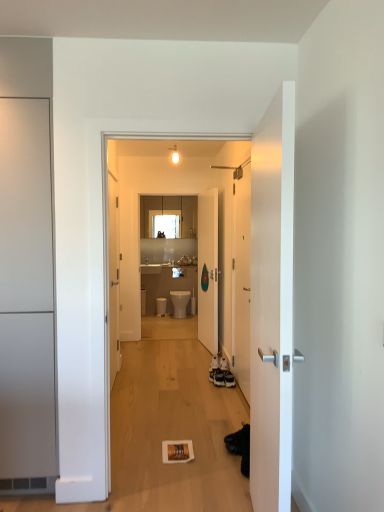
Question: Considering the relative sizes of white matte door at left, which appears as the 3th door when viewed from the back, and matte wood cabinets at upper center in the image provided, is white matte door at left, which appears as the 3th door when viewed from the back, thinner than matte wood cabinets at upper center?

Choices:
 (A) yes
 (B) no

Answer: (B)

Question: From a real-world perspective, is white matte door at left, which is the 4th door from right to left, located beneath matte wood cabinets at upper center?

Choices:
 (A) no
 (B) yes

Answer: (B)

Question: Is white matte door at left, which appears as the 3th door when viewed from the back, not within matte wood cabinets at upper center?

Choices:
 (A) yes
 (B) no

Answer: (A)

Question: Is white matte door at left, which appears as the 3th door when viewed from the back, touching matte wood cabinets at upper center?

Choices:
 (A) yes
 (B) no

Answer: (B)

Question: Could you tell me if white matte door at left, placed as the 2th door when sorted from front to back, is turned towards matte wood cabinets at upper center?

Choices:
 (A) no
 (B) yes

Answer: (A)

Question: Looking at the image, does white glossy door at center, the 4th door positioned from the left, seem bigger or smaller compared to white matte door at left, which appears as the 3th door when viewed from the back?

Choices:
 (A) small
 (B) big

Answer: (A)

Question: In terms of height, does white glossy door at center, the third door in the front-to-back sequence, look taller or shorter compared to white matte door at left, which is the 4th door from right to left?

Choices:
 (A) tall
 (B) short

Answer: (B)

Question: Is white glossy door at center, positioned as the first door in right-to-left order, wider or thinner than white matte door at left, which is the 4th door from right to left?

Choices:
 (A) wide
 (B) thin

Answer: (B)

Question: Is white glossy door at center, the 4th door positioned from the left, to the left or to the right of white matte door at left, which is the 4th door from right to left, in the image?

Choices:
 (A) left
 (B) right

Answer: (B)

Question: Choose the correct answer: Is matte wood cabinets at upper center inside white glossy door at center, the third door in the front-to-back sequence, or outside it?

Choices:
 (A) inside
 (B) outside

Answer: (B)

Question: From a real-world perspective, relative to white glossy door at center, the third door in the front-to-back sequence, is matte wood cabinets at upper center vertically above or below?

Choices:
 (A) below
 (B) above

Answer: (B)

Question: From the image's perspective, is matte wood cabinets at upper center positioned above or below white glossy door at center, the 2th door positioned from the back?

Choices:
 (A) below
 (B) above

Answer: (B)

Question: Considering the positions of matte wood cabinets at upper center and white glossy door at center, the third door in the front-to-back sequence, in the image, is matte wood cabinets at upper center bigger or smaller than white glossy door at center, the third door in the front-to-back sequence,?

Choices:
 (A) big
 (B) small

Answer: (A)

Question: From a real-world perspective, is white glossy door at center, the 4th door positioned from the left, physically located above or below matte wood cabinets at upper center?

Choices:
 (A) below
 (B) above

Answer: (A)

Question: Looking at the image, does white glossy door at center, the 2th door positioned from the back, seem bigger or smaller compared to matte wood cabinets at upper center?

Choices:
 (A) big
 (B) small

Answer: (B)